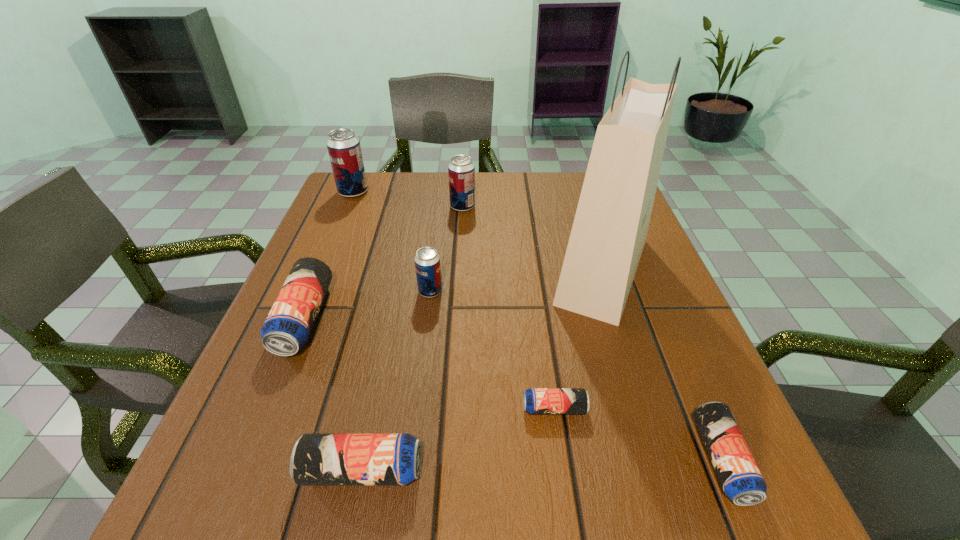
This screenshot has width=960, height=540. I want to click on the tallest object, so click(x=610, y=227).

Locate an element on the screen. The image size is (960, 540). the seventh shortest object is located at coordinates click(x=344, y=149).

The height and width of the screenshot is (540, 960). I want to click on the biggest red beer can, so tap(344, 149).

Find the location of a particular element. The height and width of the screenshot is (540, 960). the second farthest red beer can is located at coordinates (461, 170).

Where is `the second farthest beer can`? Image resolution: width=960 pixels, height=540 pixels. the second farthest beer can is located at coordinates (461, 170).

The image size is (960, 540). Find the location of `the third tallest beer can`. the third tallest beer can is located at coordinates (427, 261).

This screenshot has width=960, height=540. Find the location of `the nearest red beer can`. the nearest red beer can is located at coordinates (427, 261).

This screenshot has height=540, width=960. Find the location of `the farthest blue beer can`. the farthest blue beer can is located at coordinates (287, 328).

Where is `the biggest blue beer can`? the biggest blue beer can is located at coordinates (287, 328).

Where is `the third smallest blue beer can`? The height and width of the screenshot is (540, 960). the third smallest blue beer can is located at coordinates (317, 459).